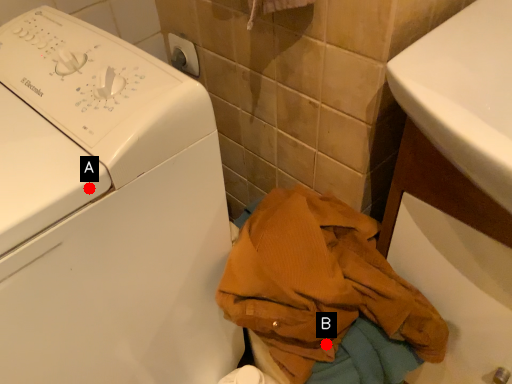
Question: Two points are circled on the image, labeled by A and B beside each circle. Which point appears closest to the camera in this image?

Choices:
 (A) A is closer
 (B) B is closer

Answer: (A)